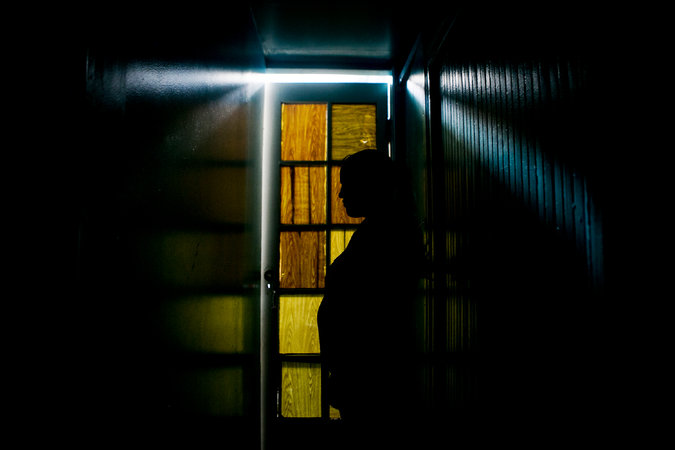
Locate an element on the screen. chest is located at coordinates (346, 252).